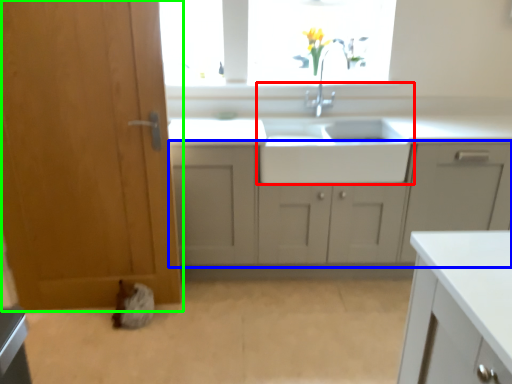
Question: Which object is the farthest from sink (highlighted by a red box)? Choose among these: cabinetry (highlighted by a blue box) or door (highlighted by a green box).

Choices:
 (A) cabinetry
 (B) door

Answer: (B)